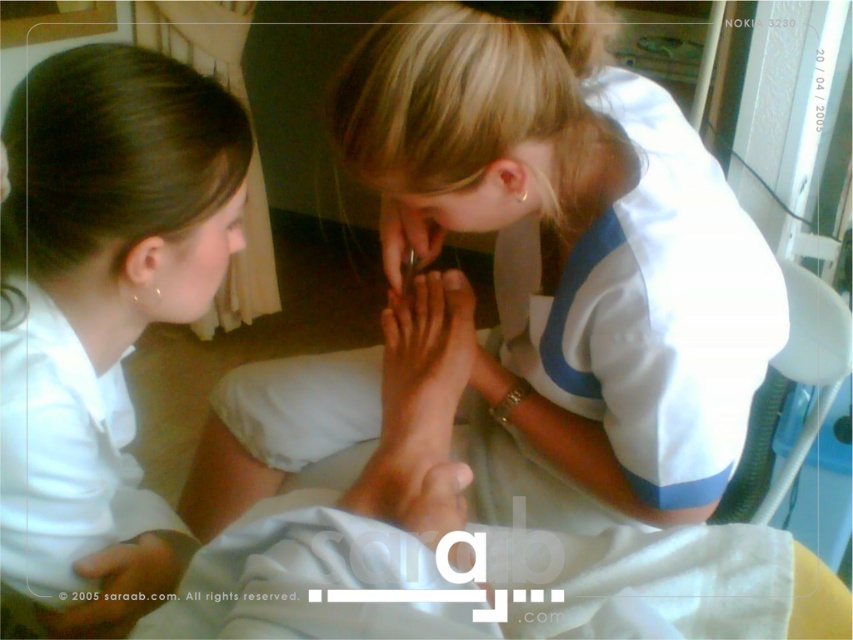
Question: Does smooth skin hand at lower center appear on the right side of metallic nail clipper at center?

Choices:
 (A) yes
 (B) no

Answer: (B)

Question: Estimate the real-world distances between objects in this image. Which object is farther from the blonde hair at upper center?

Choices:
 (A) white smooth shirt at left
 (B) light skin tone hand at center

Answer: (A)

Question: Which of the following is the closest to the observer?

Choices:
 (A) white smooth skin at lower left
 (B) smooth skin hand at lower center
 (C) metallic nail clipper at center

Answer: (A)

Question: Can you confirm if white smooth shirt at left is bigger than smooth skin hand at lower center?

Choices:
 (A) no
 (B) yes

Answer: (B)

Question: Can you confirm if white smooth shirt at left is positioned above light skin tone hand at center?

Choices:
 (A) yes
 (B) no

Answer: (A)

Question: Which of the following is the closest to the observer?

Choices:
 (A) blonde hair at upper center
 (B) smooth skin hand at lower center
 (C) white smooth shirt at left

Answer: (A)